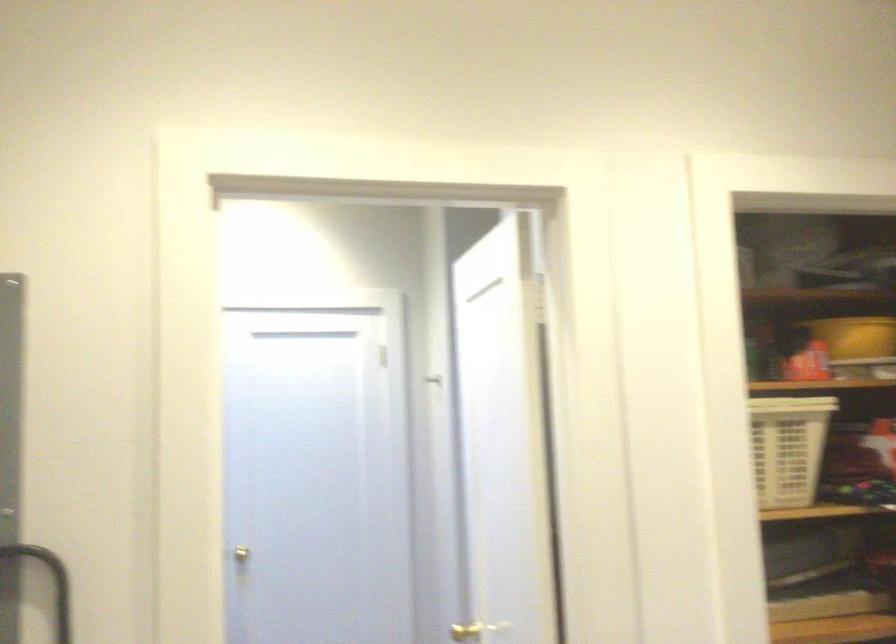
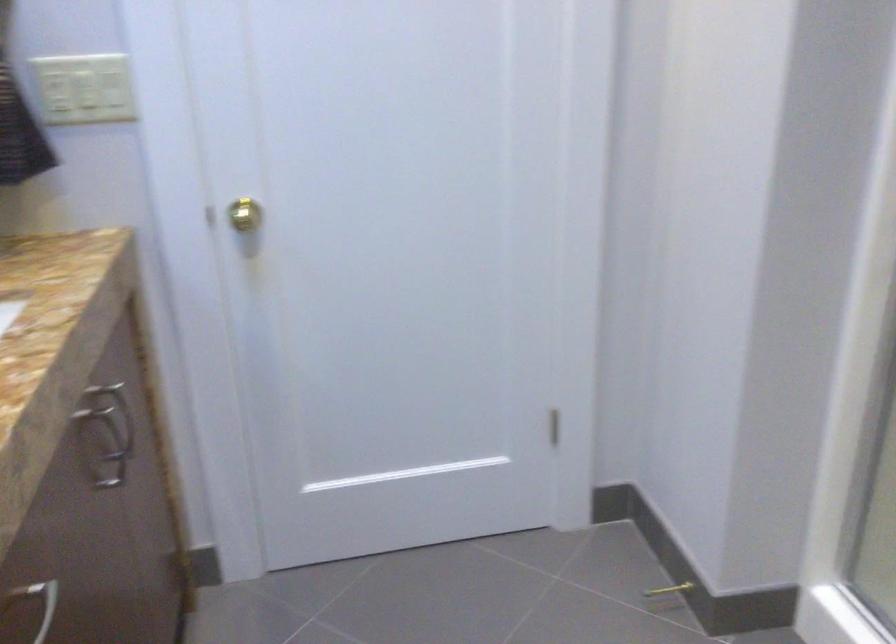
In the second image, find the point that corresponds to [245,554] in the first image.

(240, 214)